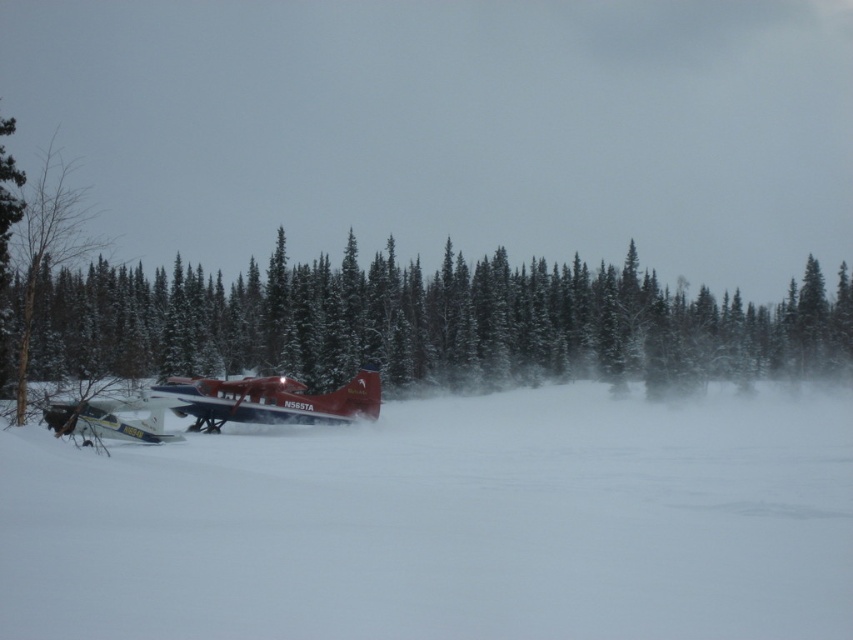
You are standing at the edge of a snowy field and see the green textured pine tree at center and the white matte airplane at lower left. Which object is higher in the image?

The green textured pine tree at center is above the white matte airplane at lower left in the image.

You are a pilot trying to park your metallic blue airplane at center and white matte airplane at lower left in a narrow hangar. Which airplane should you park first to ensure both fit inside?

You should park the white matte airplane at lower left first because the metallic blue airplane at center might be wider and requires more space, so placing it first ensures there is enough room for both.

You are a pilot trying to land a small plane in this snowy area. You notice the green textured pine tree at center and the metallic blue airplane at center. Which object is blocking your view of the other?

The green textured pine tree at center is positioned over the metallic blue airplane at center, so the tree is blocking the view of the airplane.